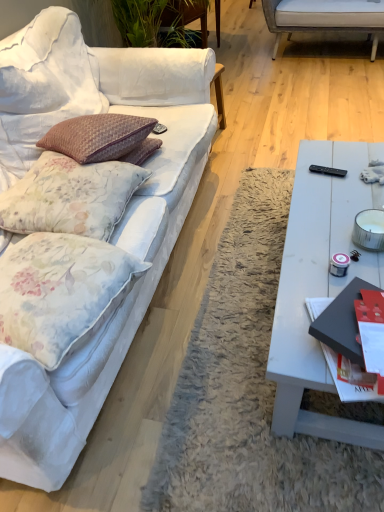
Identify the location of vacant space behind red glossy magazine at right. (312, 273).